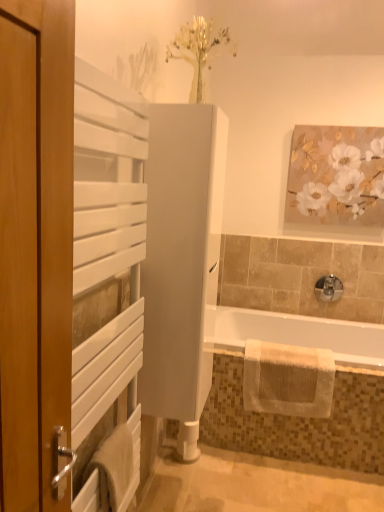
Identify the location of free space underneath white matte cabinet at center, acting as the 1th screen door starting from the back (from a real-world perspective). (180, 482).